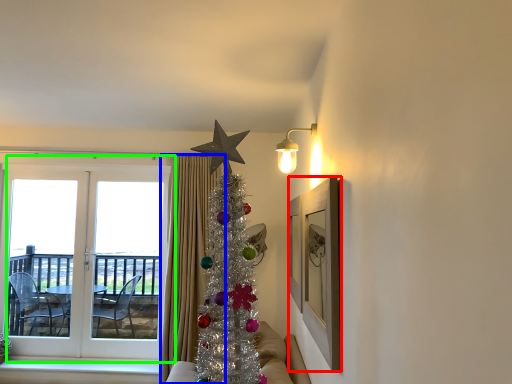
Question: Based on their relative distances, which object is farther from picture frame (highlighted by a red box)? Choose from curtain (highlighted by a blue box) and window (highlighted by a green box).

Choices:
 (A) curtain
 (B) window

Answer: (B)